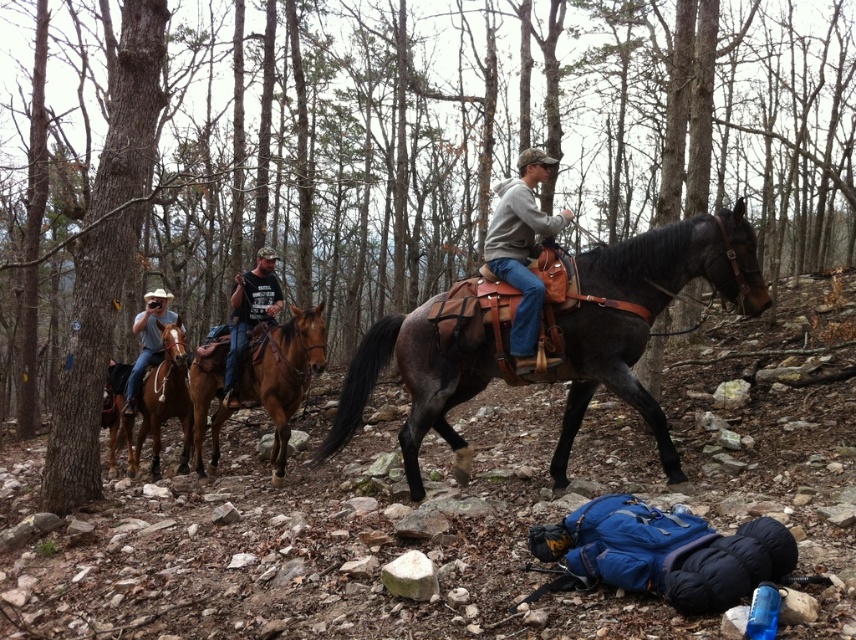
You are a photographer trying to capture the shiny brown horse at center in your shot. The camera you are using has a rectangular viewfinder with coordinates ranging from 0 to 1 on both the x and y axes. You want to ensure the horse is positioned precisely at the point specified by the coordinates. Can you confirm if the shiny brown horse at center is exactly at the point [645,314]?

Yes, the point [645,314] indicates the shiny brown horse at center, so it is exactly at that coordinate.